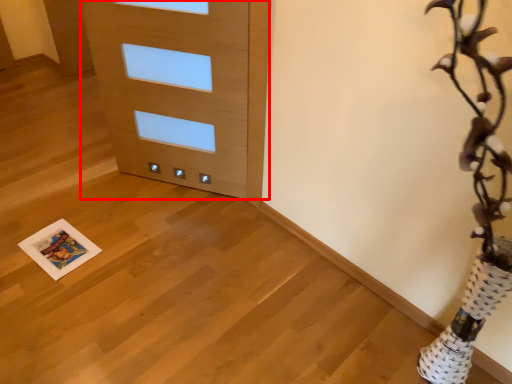
Question: Observing the image, what is the correct spatial positioning of door (annotated by the red box) in reference to print?

Choices:
 (A) left
 (B) right

Answer: (B)